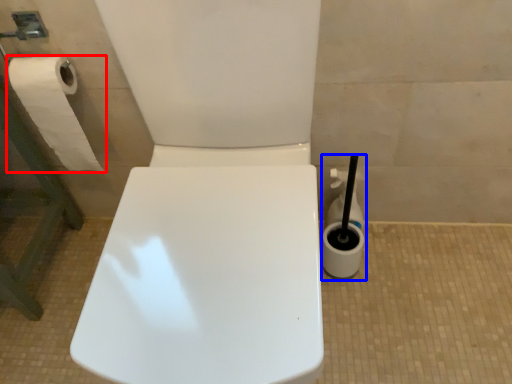
Question: Among these objects, which one is farthest to the camera, toilet paper (highlighted by a red box) or cleaning product (highlighted by a blue box)?

Choices:
 (A) toilet paper
 (B) cleaning product

Answer: (B)